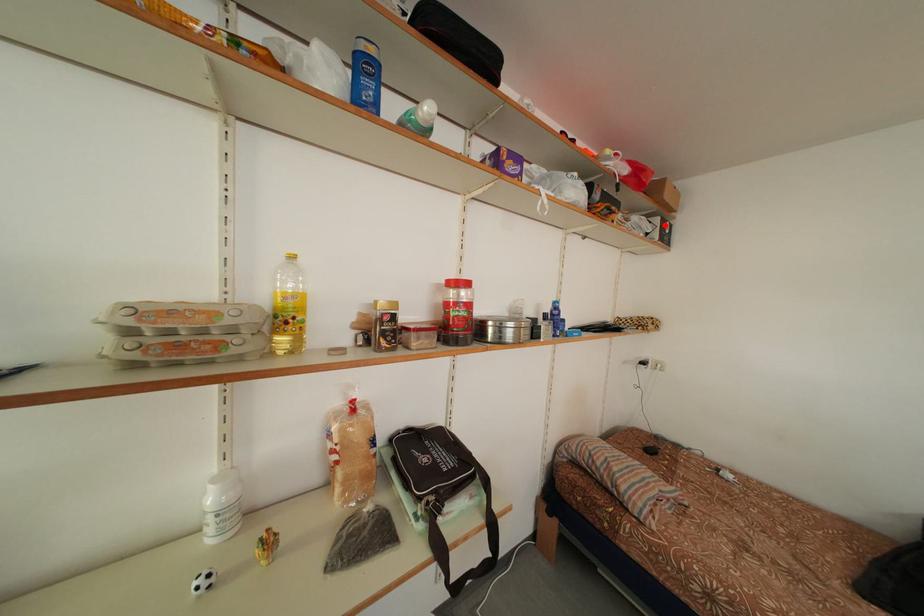
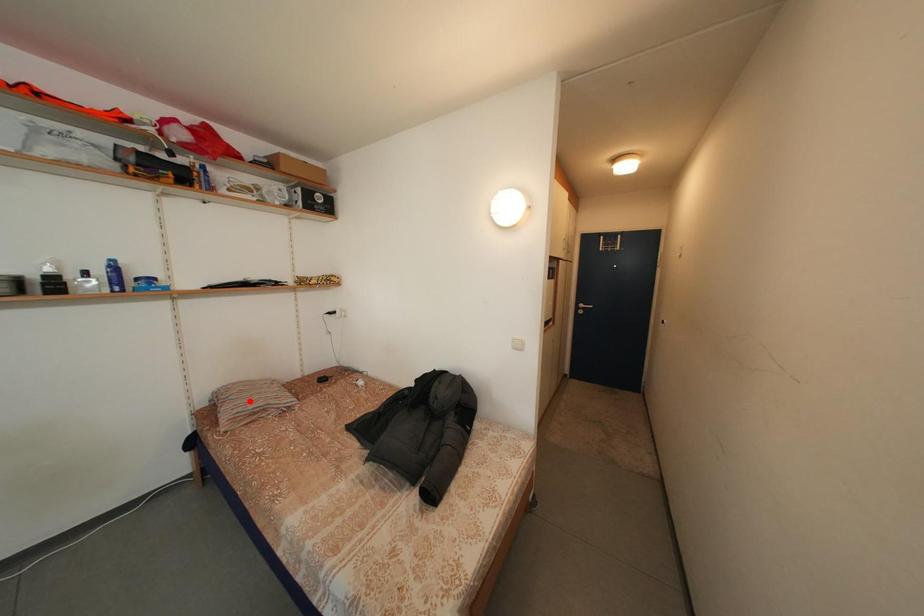
I am providing you with two images of the same scene from different viewpoints. A red point is marked on the first image and another point is marked on the second image. Does the point marked in image1 correspond to the same location as the one in image2?

No